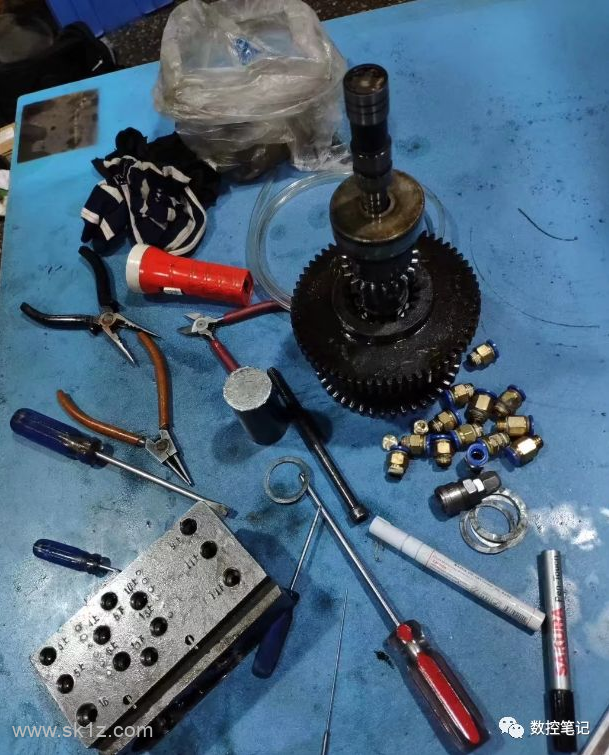
Find the location of a particular element. This screenshot has width=609, height=755. dirty blue desk is located at coordinates (515, 103).